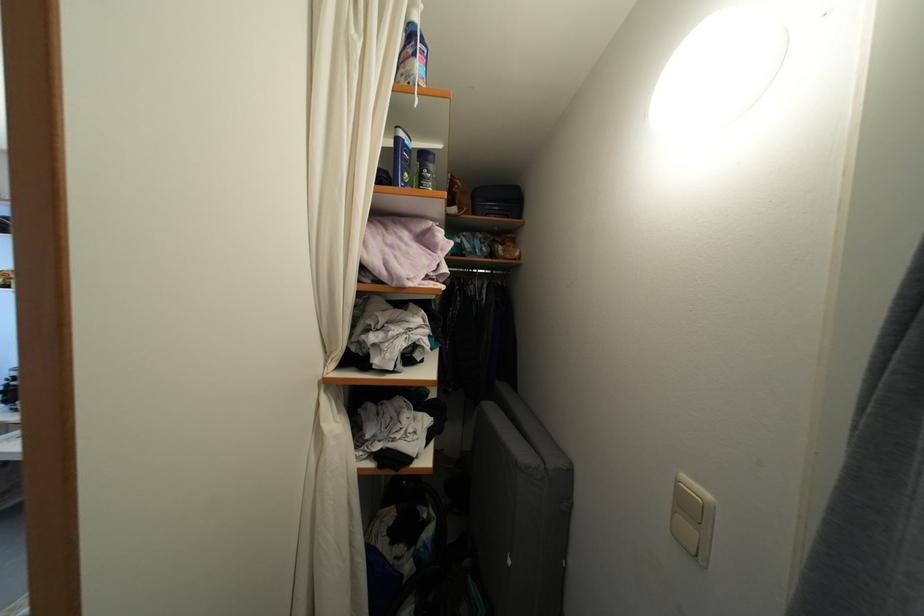
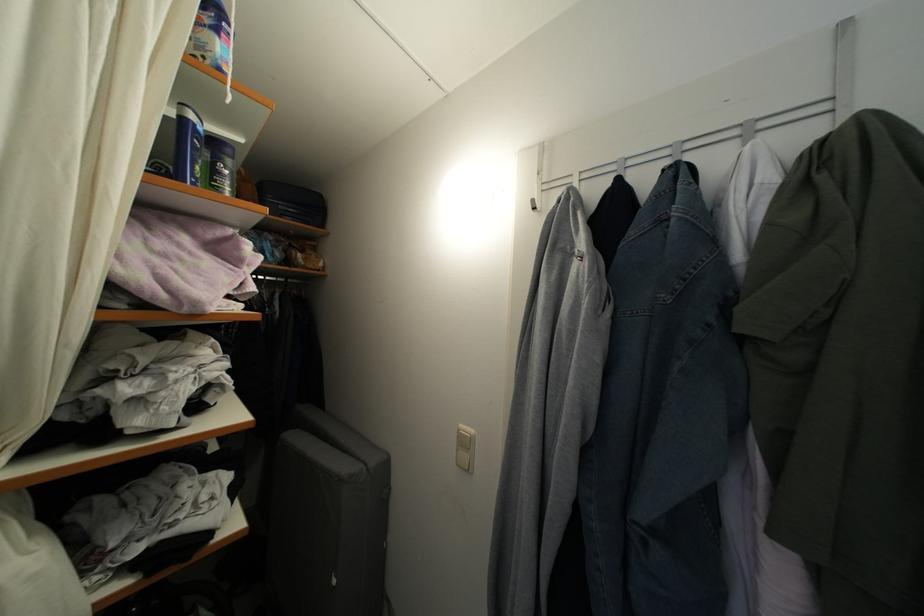
Where in the second image is the point corresponding to point 515,568 from the first image?

(339, 588)